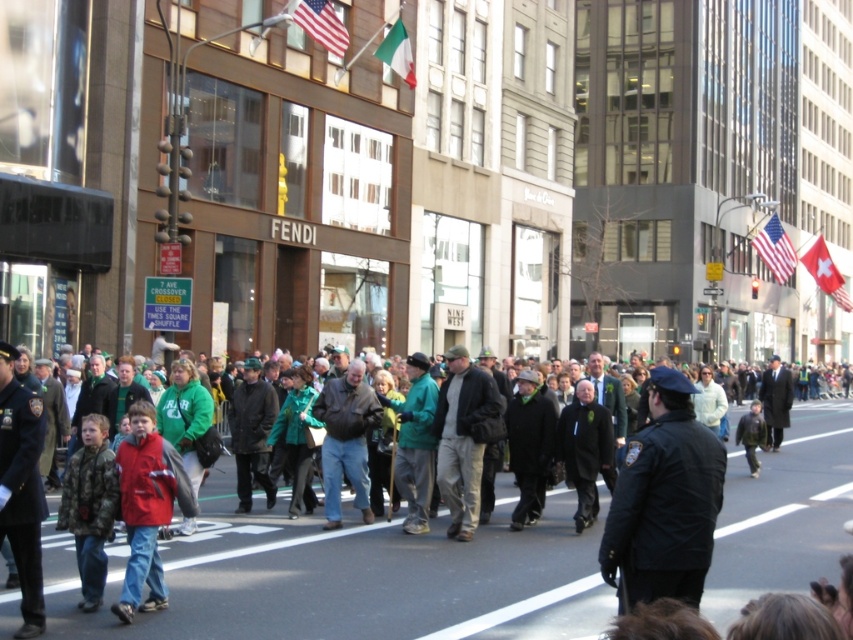
You are a photographer standing at the edge of the street. You want to take a photo of both the dark gray coat at center and the dark gray suit at center in the same frame. Given that your camera has a maximum focus range of 30 feet, will both subjects be within the focus range?

The dark gray coat at center is 30.11 feet away from dark gray suit at center. Since the distance between them exceeds the camera maximum focus range of 30 feet, it is unlikely both can be in focus simultaneously.

You are a photographer trying to capture a photo of the crowd. You notice two people wearing a green matte jacket at center and a dark gray coat at center. Which clothing item would require you to adjust your camera to a wider angle to include the entire subject in the frame?

The green matte jacket at center requires a wider angle because its width is larger than the dark gray coat at center, necessitating a broader field of view to capture the entire subject.